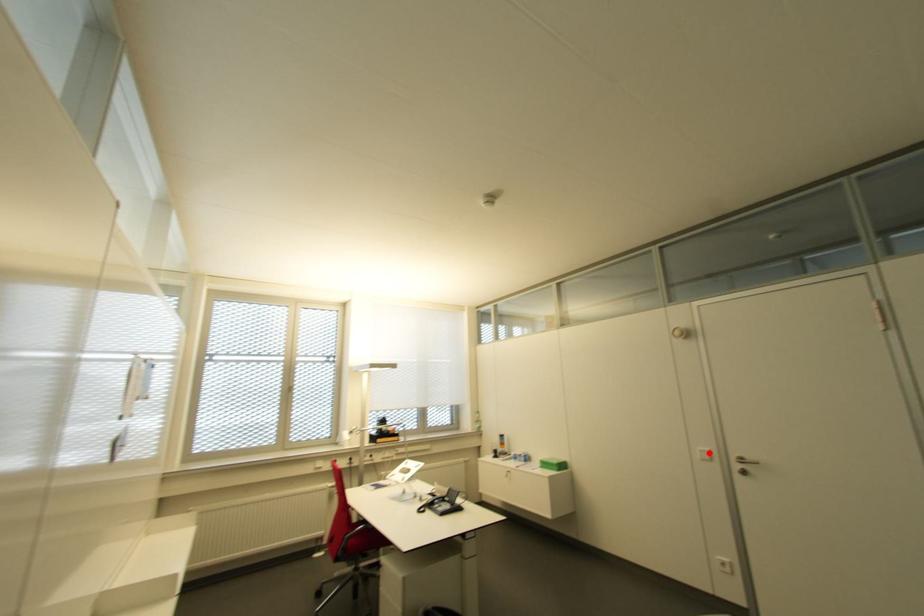
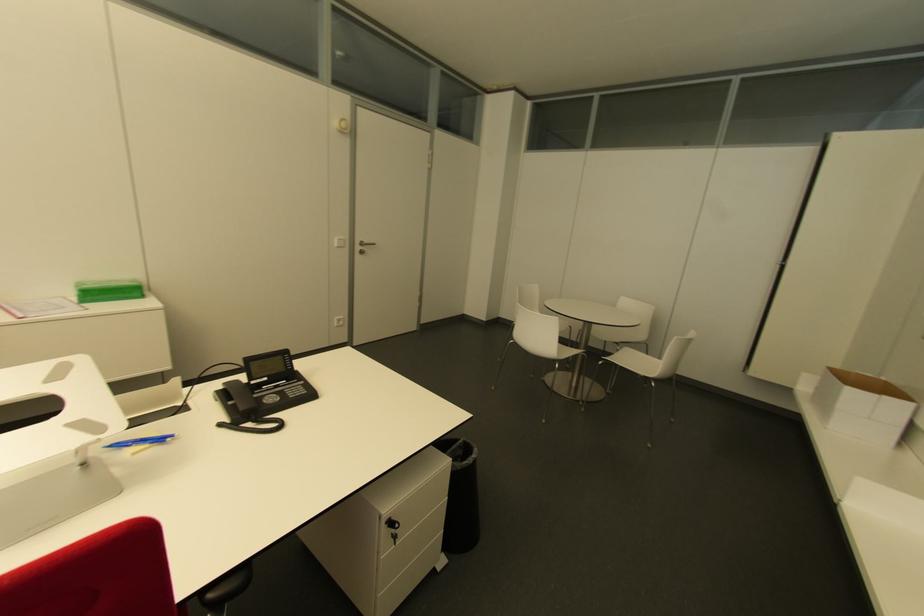
Find the pixel in the second image that matches the highlighted location in the first image.

(343, 240)